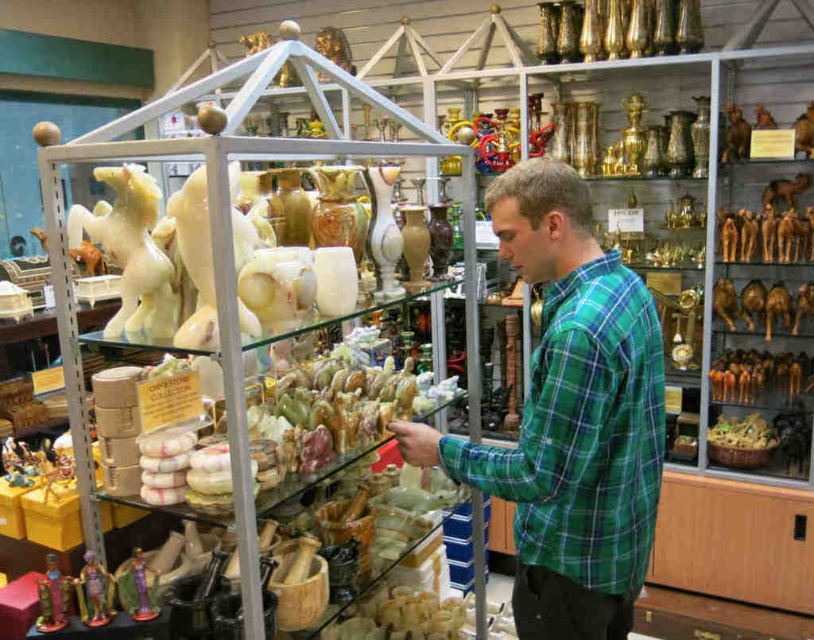
You are a customer in the shop and want to purchase the white glossy horse at center and the metallic gold figurine at lower left. You need to know their positions relative to each other to locate them easily. Can you tell me which one is positioned to the left?

The white glossy horse at center is positioned to the left of the metallic gold figurine at lower left.

You are a customer in the shop and want to know which of the two figurines at the lower left of the display case is shorter. The figurines are the purple glossy figurine at lower left and the metallic gold figurine at lower left. Can you tell me which one is shorter?

The purple glossy figurine at lower left is not as tall as metallic gold figurine at lower left, so the purple glossy figurine at lower left is shorter.

You are a customer in the shop and want to know if the green plaid shirt at center is bigger than the shiny gold figurine at lower left. Can you confirm?

The green plaid shirt at center is larger in size than the shiny gold figurine at lower left, so yes, the shirt is bigger than the figurine.